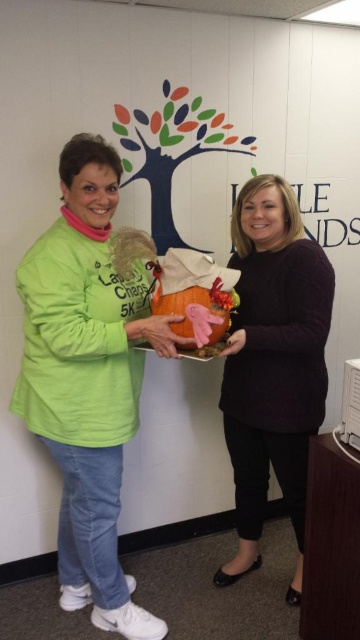
You are a photographer trying to capture the matte green shirt at left and the matte black sweater at center in a single shot. Which of the two clothing items will appear larger in the photo?

The matte green shirt at left will appear larger in the photo because it is closer to the viewer than the matte black sweater at center.

You are a photographer setting up for a group photo. You want to ensure everyone fits in the frame. The camera has a maximum width capacity of 25 inches. Given the distance between the matte green shirt at left and the matte black sweater at center, will they both fit within the camera frame?

The distance between the matte green shirt at left and the matte black sweater at center is 20.75 inches, which is under the camera frame maximum width of 25 inches. Therefore, they will both fit within the camera frame.